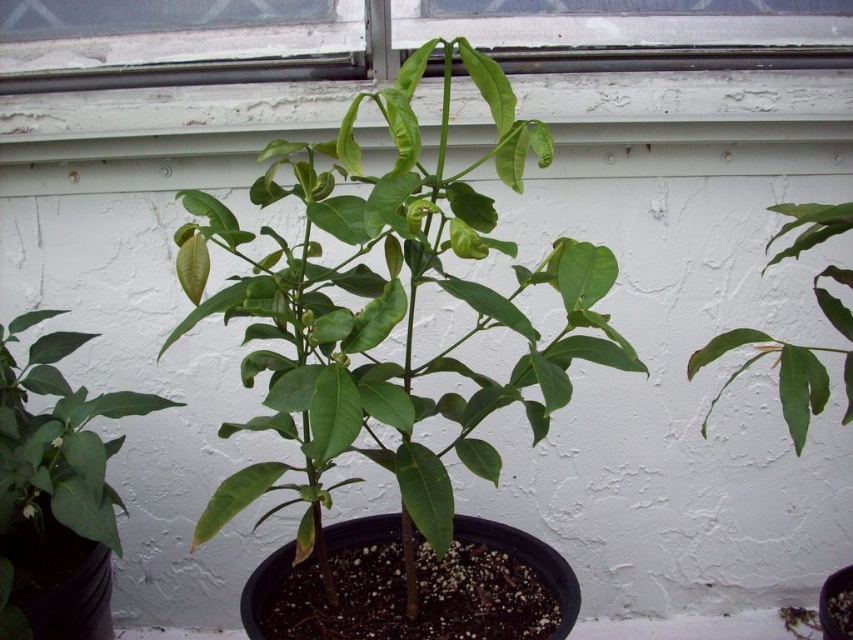
You are examining a potted citrus plant in a greenhouse. You notice two points marked on the plant. The first point is at coordinate [320,573] and the second is at [45,560]. From your perspective, which point is closer to you?

Point [320,573] is closer to the camera than point [45,560].

You are an indoor gardener who wants to prune the green glossy leafy plant at center and the green glossy leaf at center. Which one should you prune first if you want to start from the left side?

The green glossy leaf at center should be pruned first because it is positioned to the left of the green glossy leafy plant at center.

You are standing in a greenhouse and want to water the green glossy leafy plant at center. If your watering can has a 30 inch long extension handle, can you reach the plant without moving closer?

The distance between you and the green glossy leafy plant at center is 34.00 inches. Since the watering can handle is only 30 inches long, you cannot reach the plant without moving closer.